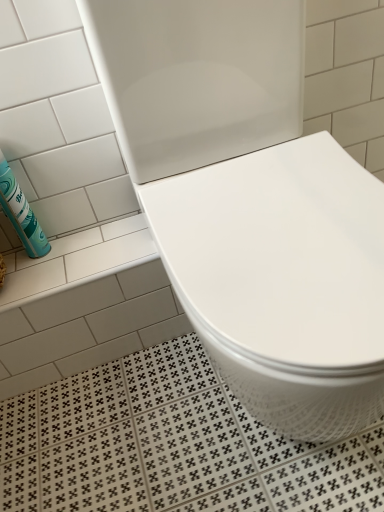
Describe the element at coordinates (21, 213) in the screenshot. This screenshot has width=384, height=512. I see `teal matte canister at left` at that location.

Where is `teal matte canister at left`? teal matte canister at left is located at coordinates (21, 213).

Identify the location of white glossy toilet at center. (250, 204).

What do you see at coordinates (250, 204) in the screenshot? I see `white glossy toilet at center` at bounding box center [250, 204].

The height and width of the screenshot is (512, 384). Identify the location of teal matte canister at left. (21, 213).

Considering the positions of objects white glossy toilet at center and teal matte canister at left in the image provided, who is more to the left, white glossy toilet at center or teal matte canister at left?

Positioned to the left is teal matte canister at left.

Considering their positions, is white glossy toilet at center located in front of or behind teal matte canister at left?

Clearly, white glossy toilet at center is in front of teal matte canister at left.

Is point (159, 234) in front of point (19, 237)?

That is True.

From the image's perspective, between white glossy toilet at center and teal matte canister at left, who is located below?

white glossy toilet at center, from the image's perspective.

From a real-world perspective, between white glossy toilet at center and teal matte canister at left, who is vertically higher?

In real-world perspective, teal matte canister at left is above.

Considering the relative sizes of white glossy toilet at center and teal matte canister at left in the image provided, is white glossy toilet at center thinner than teal matte canister at left?

Incorrect, the width of white glossy toilet at center is not less than that of teal matte canister at left.

Which of these two, white glossy toilet at center or teal matte canister at left, stands taller?

white glossy toilet at center.

Does white glossy toilet at center have a larger size compared to teal matte canister at left?

Yes.

Is white glossy toilet at center completely or partially outside of teal matte canister at left?

Yes.

Based on the photo, is white glossy toilet at center touching teal matte canister at left?

There is a gap between white glossy toilet at center and teal matte canister at left.

Is white glossy toilet at center aimed at teal matte canister at left?

No, white glossy toilet at center is not aimed at teal matte canister at left.

Find the location of `toilet located in front of the teal matte canister at left`. toilet located in front of the teal matte canister at left is located at coordinates (250, 204).

Which is more to the right, teal matte canister at left or white glossy toilet at center?

white glossy toilet at center is more to the right.

Is teal matte canister at left closer to camera compared to white glossy toilet at center?

No, teal matte canister at left is further to the viewer.

Which is behind, point (43, 241) or point (334, 243)?

The point (43, 241) is farther from the camera.

From the image's perspective, is teal matte canister at left on top of white glossy toilet at center?

Yes, from the image's perspective, teal matte canister at left is over white glossy toilet at center.

From a real-world perspective, relative to white glossy toilet at center, is teal matte canister at left vertically above or below?

teal matte canister at left is above white glossy toilet at center.

Considering the sizes of objects teal matte canister at left and white glossy toilet at center in the image provided, who is thinner, teal matte canister at left or white glossy toilet at center?

teal matte canister at left.

Is teal matte canister at left taller or shorter than white glossy toilet at center?

teal matte canister at left is shorter than white glossy toilet at center.

Which of these two, teal matte canister at left or white glossy toilet at center, is bigger?

With larger size is white glossy toilet at center.

Is teal matte canister at left situated inside white glossy toilet at center or outside?

teal matte canister at left cannot be found inside white glossy toilet at center.

Is teal matte canister at left far from white glossy toilet at center?

No, there isn't a large distance between teal matte canister at left and white glossy toilet at center.

Is teal matte canister at left facing away from white glossy toilet at center?

No, teal matte canister at left's orientation is not away from white glossy toilet at center.

How many degrees apart are the facing directions of teal matte canister at left and white glossy toilet at center?

The angular difference between teal matte canister at left and white glossy toilet at center is 4.1 degrees.

Where is `cleaning product above the white glossy toilet at center (from the image's perspective)`? The image size is (384, 512). cleaning product above the white glossy toilet at center (from the image's perspective) is located at coordinates (21, 213).

Locate an element on the screen. The image size is (384, 512). toilet that appears below the teal matte canister at left (from a real-world perspective) is located at coordinates (250, 204).

Find the location of a particular element. cleaning product to the left of white glossy toilet at center is located at coordinates (21, 213).